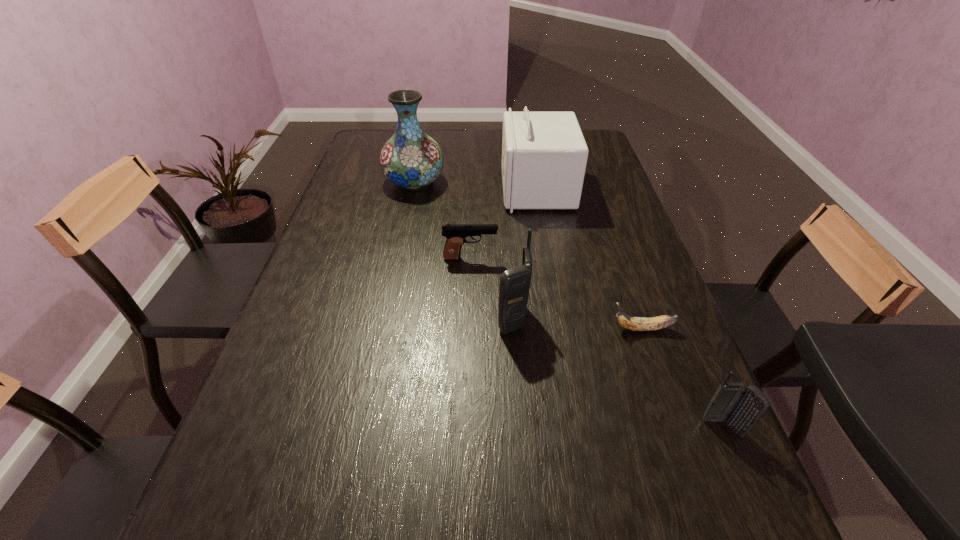
Locate an element on the screen. free spot located on the keyboard of the farther cellular telephone is located at coordinates (424, 319).

Find the location of a particular element. The image size is (960, 540). free space located 0.120m on the keyboard of the farther cellular telephone is located at coordinates (445, 319).

You are a GUI agent. You are given a task and a screenshot of the screen. Output one action in this format:
    pyautogui.click(x=<x>, y=<y>)
    Task: Click on the vacant position located on the front-facing side of the first-aid kit
    The height and width of the screenshot is (540, 960).
    Given the screenshot: What is the action you would take?
    pyautogui.click(x=393, y=190)

At what (x,y) coordinates should I click in order to perform the action: click on vacant region located 0.380m on the front-facing side of the first-aid kit. Please return your answer as a coordinate pair (x, y). Looking at the image, I should click on (386, 190).

Locate an element on the screen. This screenshot has width=960, height=540. free location located on the front-facing side of the first-aid kit is located at coordinates (484, 190).

Image resolution: width=960 pixels, height=540 pixels. I want to click on free point located 0.140m on the front of the leftmost object, so click(405, 225).

Find the location of a particular element. The width and height of the screenshot is (960, 540). free space located 0.400m at the barrel of the fourth nearest object is located at coordinates (645, 258).

Identify the location of vacant space located on the peel of the shortest object. Image resolution: width=960 pixels, height=540 pixels. (515, 329).

Locate an element on the screen. The image size is (960, 540). vacant space located on the peel of the shortest object is located at coordinates (580, 329).

Locate an element on the screen. The width and height of the screenshot is (960, 540). vacant space located 0.230m on the peel of the shortest object is located at coordinates (510, 329).